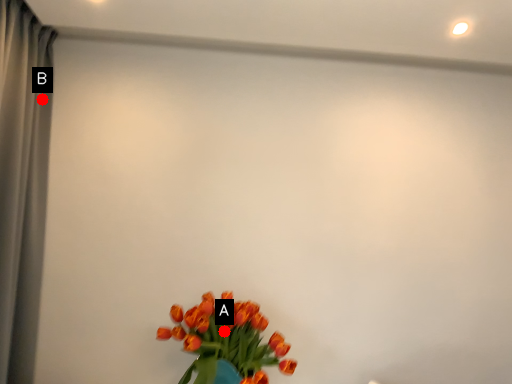
Question: Two points are circled on the image, labeled by A and B beside each circle. Which of the following is the farthest from the observer?

Choices:
 (A) A is further
 (B) B is further

Answer: (B)